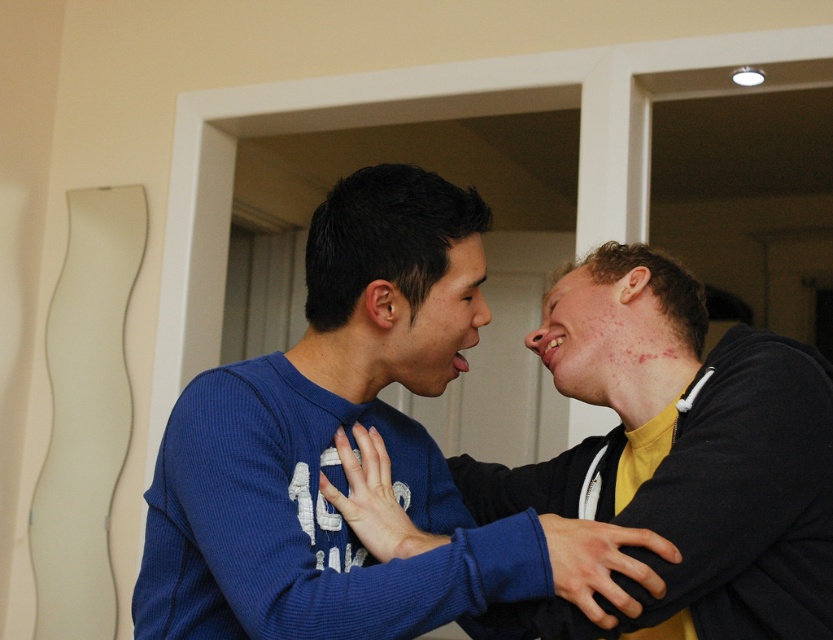
In the scene shown: You are organizing a clothing store and need to arrange the blue thermal sweater at center and the matte blue sweater at center on a rack. Since the rack has limited space, you want to place the smaller one first. Which sweater should you place first?

The blue thermal sweater at center has a smaller size compared to matte blue sweater at center, so you should place the blue thermal sweater at center first to maximize space efficiency.

You are designing a clothing catalog and need to place the blue thermal sweater at center and the matte blue sweater at center side by side. Which one should you place on the left to ensure they fit within a 1.5 meter wide display area?

The blue thermal sweater at center has a lesser width compared to the matte blue sweater at center, so placing the narrower blue thermal sweater at center on the left would allow both sweaters to fit within the 1.5 meter display area.